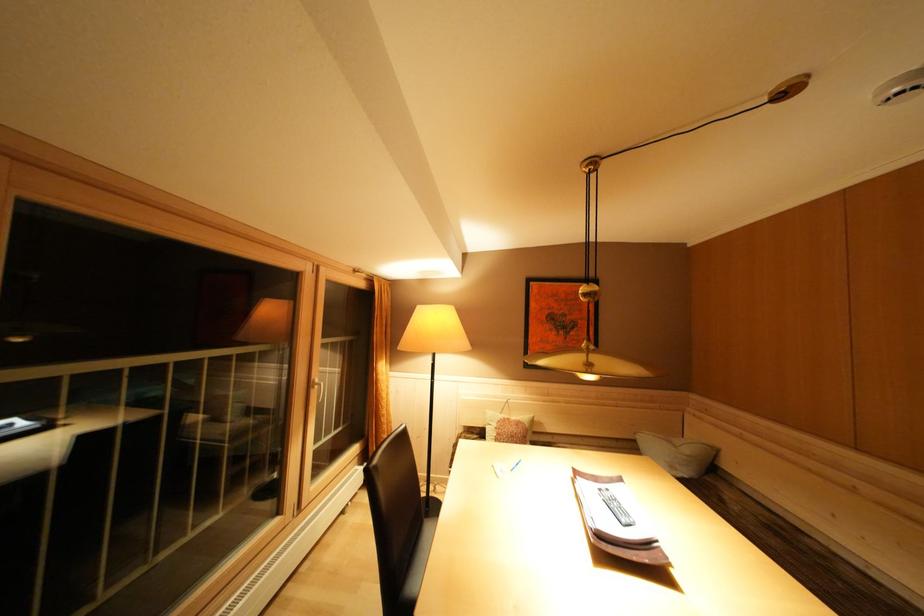
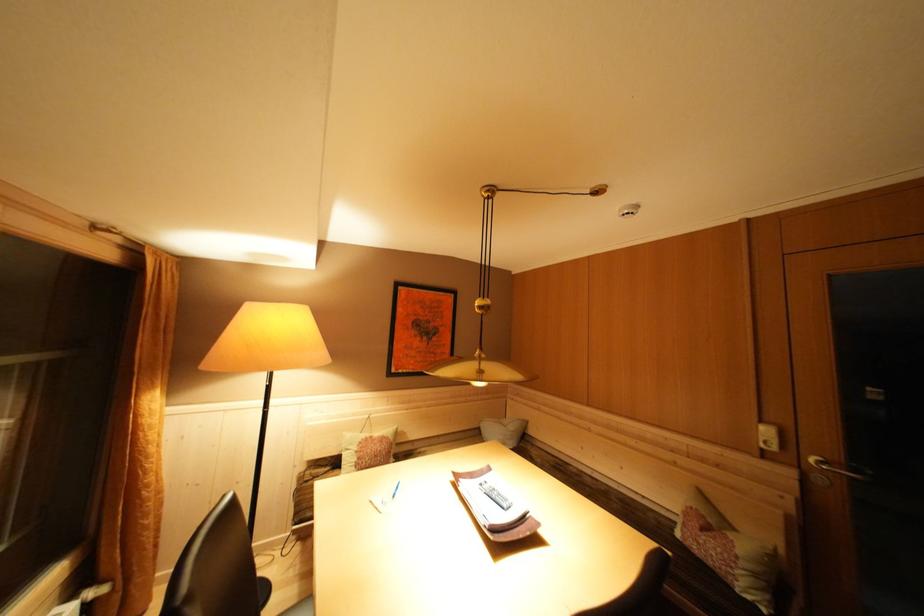
Find the pixel in the second image that matches pixel 696 453 in the first image.

(518, 430)